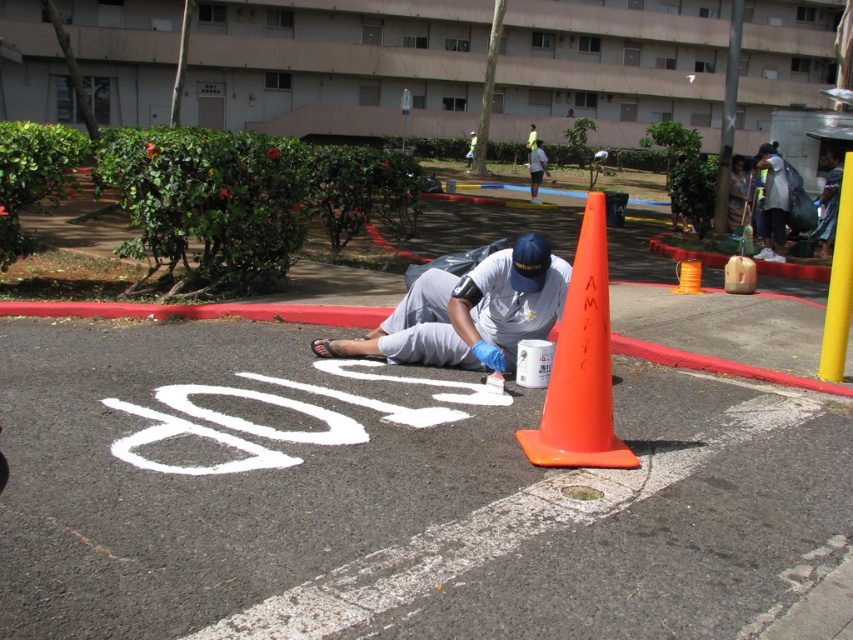
Question: Which object appears closest to the camera in this image?

Choices:
 (A) white matte shirt at center
 (B) white painted pavement at center
 (C) orange plastic traffic cone at center
 (D) white matte uniform at center

Answer: (B)

Question: Is white matte uniform at center above red rubber curb at lower center?

Choices:
 (A) no
 (B) yes

Answer: (B)

Question: Does white matte uniform at center appear over orange plastic traffic cone at center?

Choices:
 (A) no
 (B) yes

Answer: (B)

Question: Can you confirm if red rubber curb at lower center is wider than white matte shirt at center?

Choices:
 (A) no
 (B) yes

Answer: (A)

Question: Which point is closer to the camera?

Choices:
 (A) orange plastic traffic cone at center
 (B) white matte shirt at center
 (C) dark gray fabric shirt at upper right
 (D) white painted pavement at center

Answer: (D)

Question: Considering the real-world distances, which object is closest to the dark gray fabric shirt at upper right?

Choices:
 (A) white matte uniform at center
 (B) white painted pavement at center

Answer: (A)